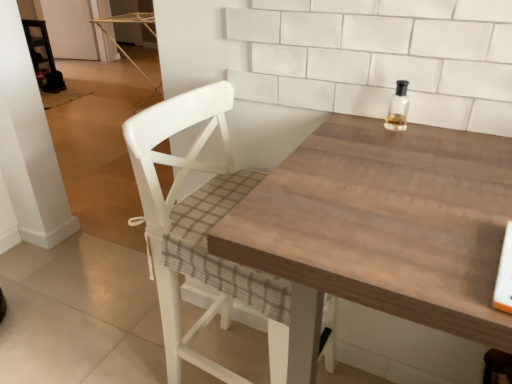
Identify the location of vacant region to the left of white wood chair at center. This screenshot has height=384, width=512. point(122,340).